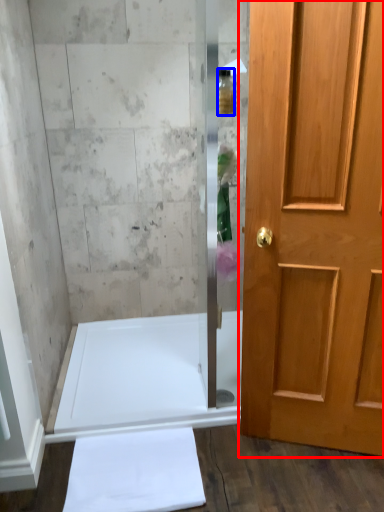
Question: Among these objects, which one is nearest to the camera, door (highlighted by a red box) or toiletry (highlighted by a blue box)?

Choices:
 (A) door
 (B) toiletry

Answer: (A)